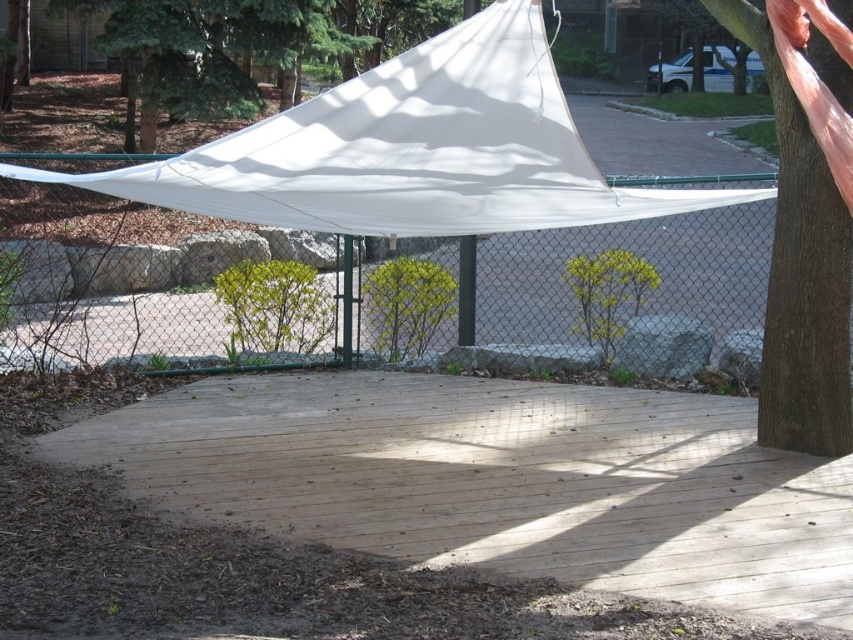
Does natural wood deck at center have a larger size compared to white fabric canopy at upper center?

Incorrect, natural wood deck at center is not larger than white fabric canopy at upper center.

Can you confirm if natural wood deck at center is positioned to the right of white fabric canopy at upper center?

Indeed, natural wood deck at center is positioned on the right side of white fabric canopy at upper center.

Does point (323, 445) come behind point (381, 74)?

Yes.

Where is `natural wood deck at center`? natural wood deck at center is located at coordinates (498, 481).

Between white mesh fence at center and white fabric canopy at upper center, which one is positioned lower?

white mesh fence at center

Is white mesh fence at center below white fabric canopy at upper center?

Yes.

Locate an element on the screen. white mesh fence at center is located at coordinates (373, 296).

Identify the location of white mesh fence at center. The image size is (853, 640). (373, 296).

Is natural wood deck at center positioned in front of white mesh fence at center?

Yes, natural wood deck at center is closer to the viewer.

This screenshot has width=853, height=640. What do you see at coordinates (498, 481) in the screenshot? I see `natural wood deck at center` at bounding box center [498, 481].

Between point (598, 493) and point (82, 244), which one is positioned behind?

Point (82, 244)

The height and width of the screenshot is (640, 853). In order to click on natural wood deck at center in this screenshot , I will do `click(498, 481)`.